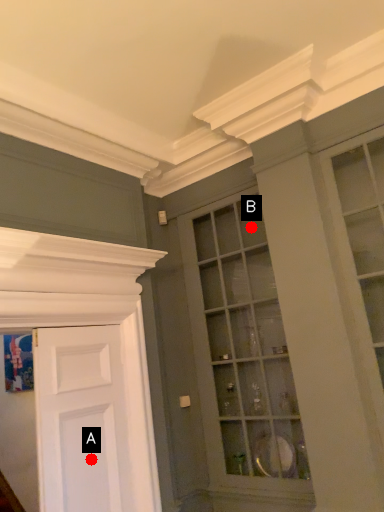
Question: Two points are circled on the image, labeled by A and B beside each circle. Which point is closer to the camera?

Choices:
 (A) A is closer
 (B) B is closer

Answer: (A)